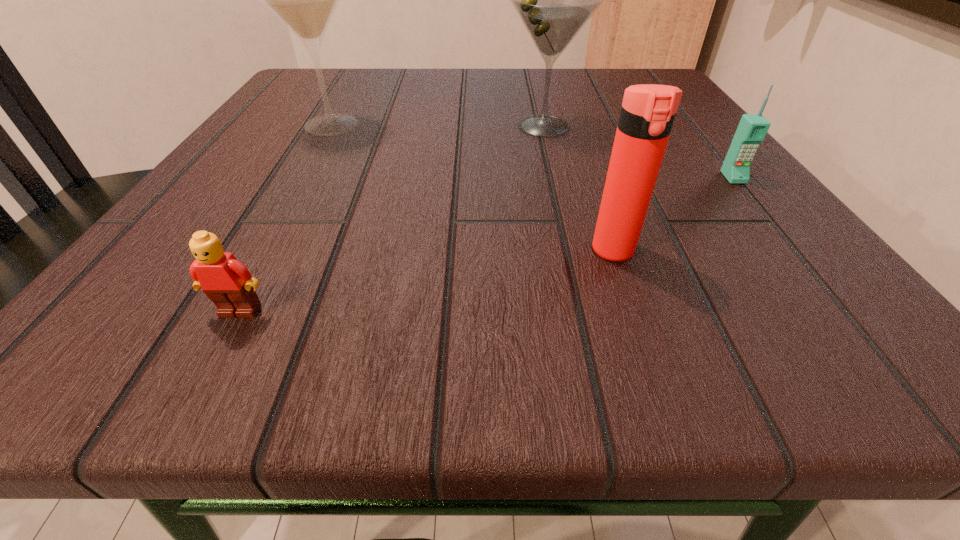
The height and width of the screenshot is (540, 960). Identify the location of the right martini. (554, 0).

Identify the location of the left martini. Image resolution: width=960 pixels, height=540 pixels. (304, 0).

You are a GUI agent. You are given a task and a screenshot of the screen. Output one action in this format:
    pyautogui.click(x=<x>, y=<y>)
    Task: Click on the second nearest object
    The height and width of the screenshot is (540, 960).
    Given the screenshot: What is the action you would take?
    pyautogui.click(x=648, y=111)

Identify the location of cellular telephone. The image size is (960, 540). (752, 129).

Where is `the rightmost object`? the rightmost object is located at coordinates (752, 129).

Where is `the nearest object`? Image resolution: width=960 pixels, height=540 pixels. the nearest object is located at coordinates (228, 283).

Locate an element on the screen. The image size is (960, 540). Lego is located at coordinates point(228,283).

Locate an element on the screen. The height and width of the screenshot is (540, 960). vacant space positioned 0.300m on the front of the right martini is located at coordinates (579, 275).

Identify the location of vacant region located 0.060m on the right of the left martini. (407, 125).

Locate an element on the screen. The width and height of the screenshot is (960, 540). free space located on the left of the thermos bottle is located at coordinates (237, 251).